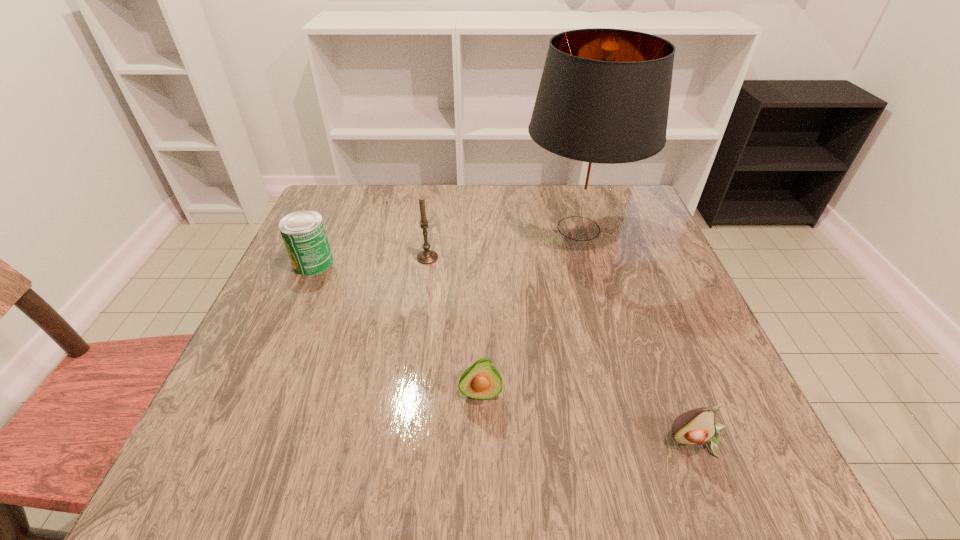
Where is `free space that is in between the can and the third object from left to right`? free space that is in between the can and the third object from left to right is located at coordinates (396, 328).

Where is `free space between the can and the fourth farthest object`? The width and height of the screenshot is (960, 540). free space between the can and the fourth farthest object is located at coordinates (396, 328).

Identify the location of vacant area that lies between the second tallest object and the nearer avocado. (563, 349).

I want to click on unoccupied area between the leftmost object and the left avocado, so click(x=396, y=328).

This screenshot has height=540, width=960. I want to click on free space between the nearest object and the fourth object from right to left, so click(563, 349).

This screenshot has width=960, height=540. I want to click on object that is the second nearest to the tallest object, so click(481, 380).

Find the location of a particular element. The image size is (960, 540). object that is the closest to the fourth shortest object is located at coordinates (303, 232).

The width and height of the screenshot is (960, 540). Identify the location of vacant space that satisfies the following two spatial constraints: 1. on the back side of the can; 2. on the right side of the fourth shortest object. (316, 258).